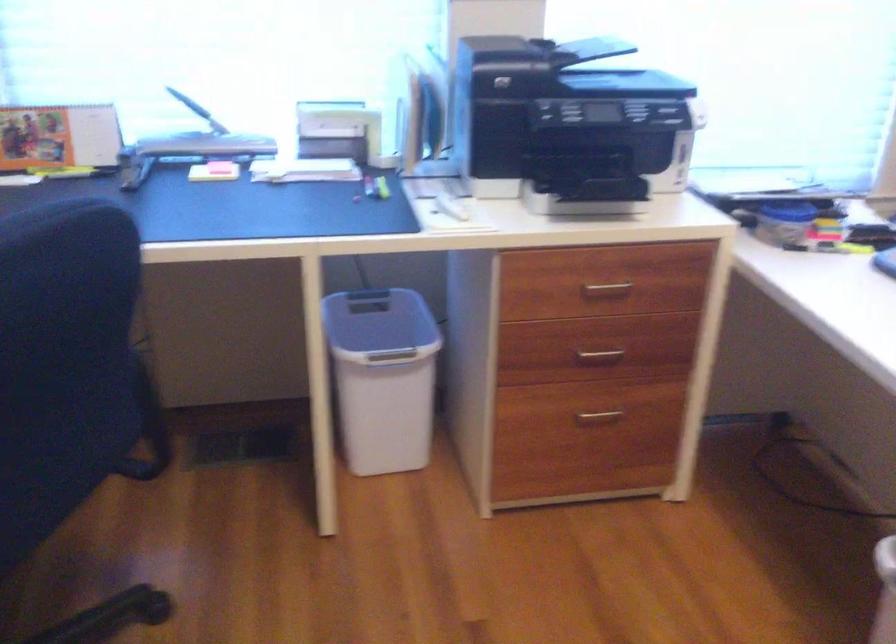
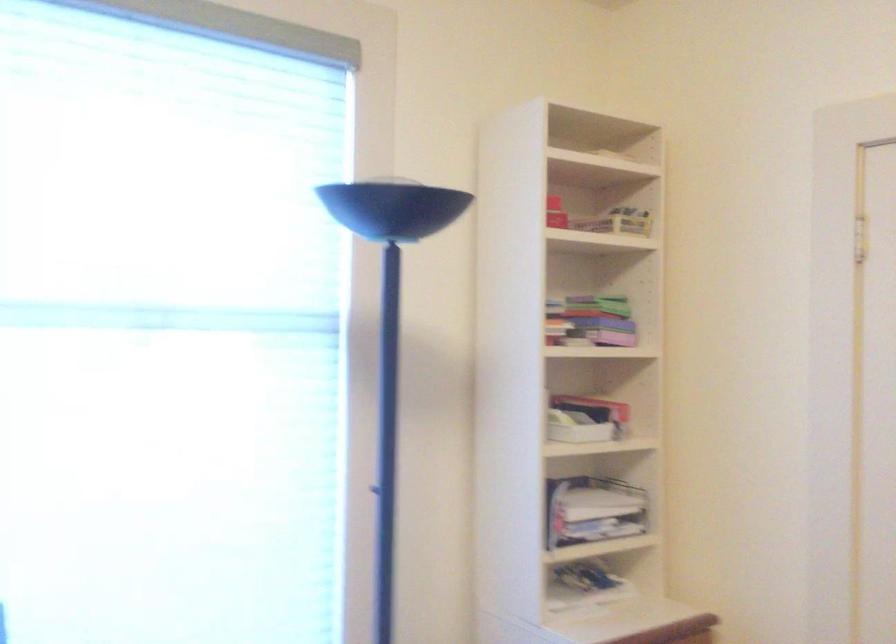
First-person continuous shooting, in which direction is the camera rotating?

The camera rotated toward right-up.